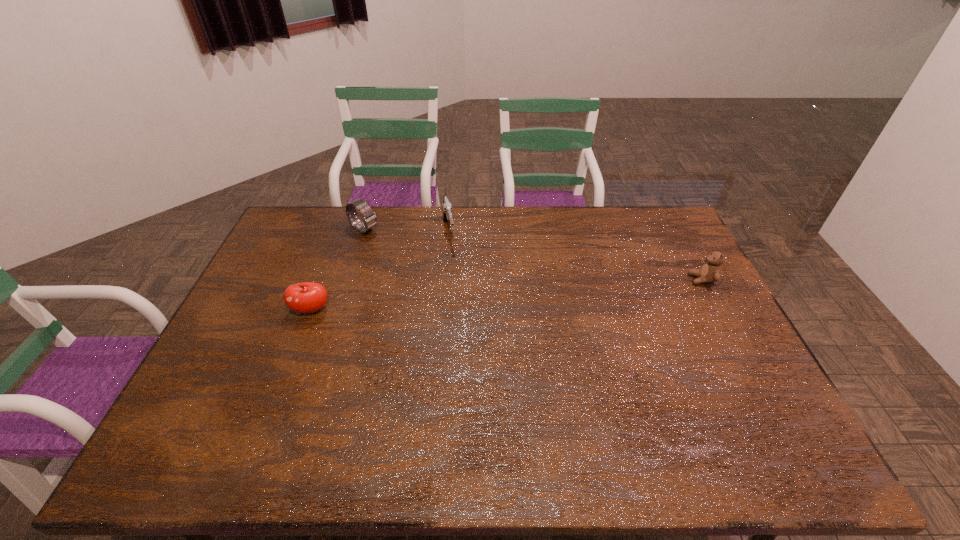
The width and height of the screenshot is (960, 540). In order to click on free location located at the muzzle of the gun in this screenshot , I will do `click(466, 310)`.

Image resolution: width=960 pixels, height=540 pixels. Identify the location of free region located 0.360m at the muzzle of the gun. (469, 327).

At what (x,y) coordinates should I click in order to perform the action: click on vacant space located 0.120m on the face of the watch. Please return your answer as a coordinate pair (x, y). The height and width of the screenshot is (540, 960). Looking at the image, I should click on (398, 248).

You are a GUI agent. You are given a task and a screenshot of the screen. Output one action in this format:
    pyautogui.click(x=<x>, y=<y>)
    Task: Click on the vacant space positioned 0.230m on the face of the watch
    This screenshot has height=540, width=960.
    Given the screenshot: What is the action you would take?
    pyautogui.click(x=420, y=261)

This screenshot has height=540, width=960. What are the coordinates of `free location located on the face of the watch` in the screenshot? It's located at (425, 264).

I want to click on gun located at the far edge, so click(x=446, y=205).

This screenshot has width=960, height=540. What are the coordinates of `watch at the far edge` in the screenshot? It's located at (370, 219).

Locate an element on the screen. This screenshot has height=540, width=960. object at the left edge is located at coordinates (307, 297).

You are a GUI agent. You are given a task and a screenshot of the screen. Output one action in this format:
    pyautogui.click(x=<x>, y=<y>)
    Task: Click on the object present at the right edge
    Image resolution: width=960 pixels, height=540 pixels.
    Given the screenshot: What is the action you would take?
    pyautogui.click(x=710, y=272)

Where is `free region at the far edge of the desktop`? free region at the far edge of the desktop is located at coordinates (488, 244).